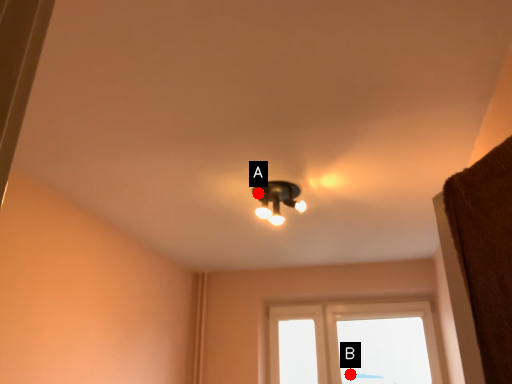
Question: Two points are circled on the image, labeled by A and B beside each circle. Which point is closer to the camera?

Choices:
 (A) A is closer
 (B) B is closer

Answer: (A)